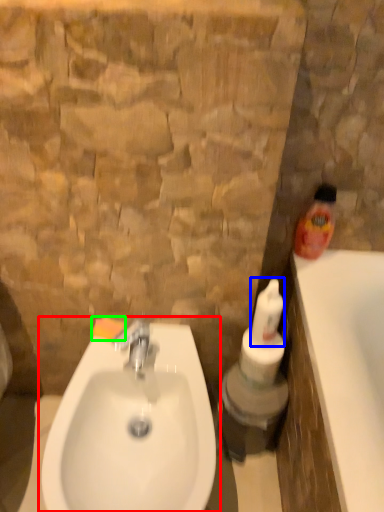
Question: Which object is positioned closest to sink (highlighted by a red box)? Select from cleaning product (highlighted by a blue box) and soap (highlighted by a green box).

Choices:
 (A) cleaning product
 (B) soap

Answer: (B)